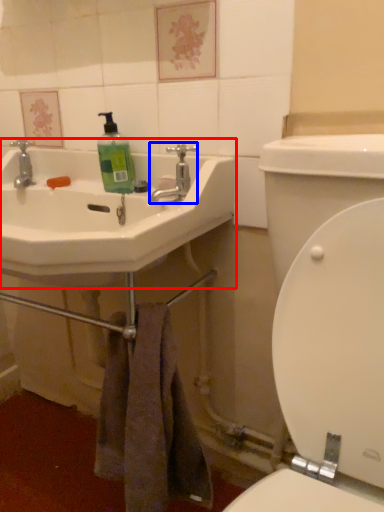
Question: Among these objects, which one is farthest to the camera, sink (highlighted by a red box) or tap (highlighted by a blue box)?

Choices:
 (A) sink
 (B) tap

Answer: (B)